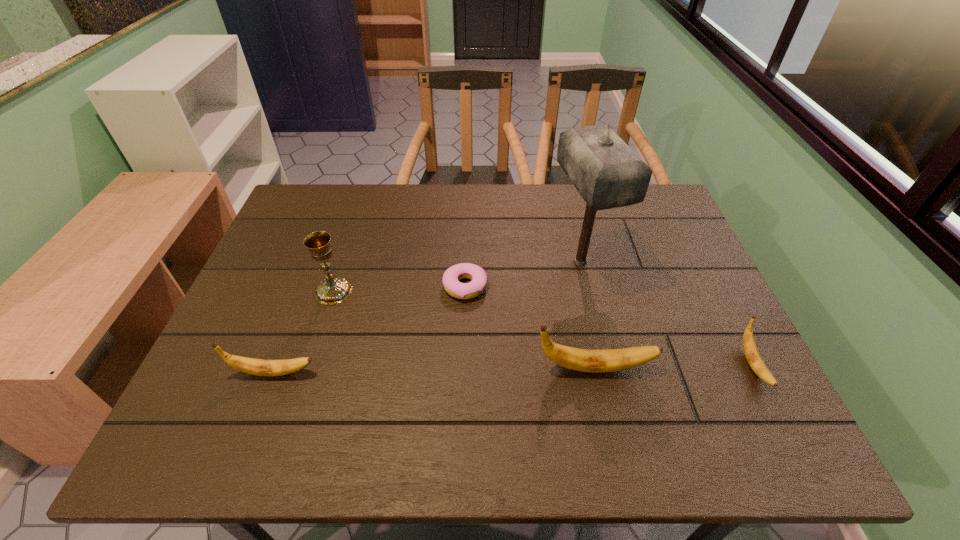
To make them evenly spaced by inserting another banana among them, please locate a free space for this new banana. Please provide its 2D coordinates. Your answer should be formatted as a tuple, i.e. [(x, y)], where the tuple contains the x and y coordinates of a point satisfying the conditions above.

[(435, 370)]